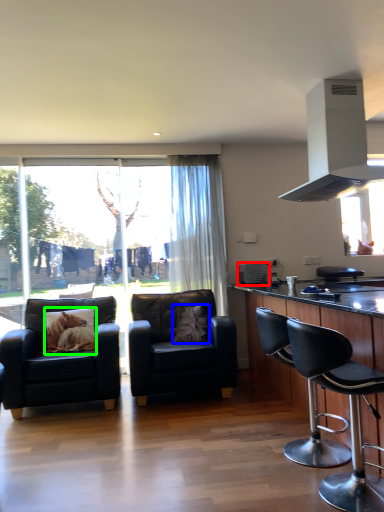
Question: Which object is positioned farthest from appliance (highlighted by a red box)? Select from pillow (highlighted by a blue box) and pillow (highlighted by a green box).

Choices:
 (A) pillow
 (B) pillow

Answer: (B)